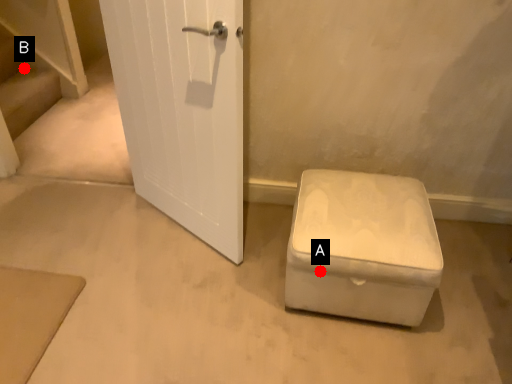
Question: Two points are circled on the image, labeled by A and B beside each circle. Which point is farther to the camera?

Choices:
 (A) A is further
 (B) B is further

Answer: (B)